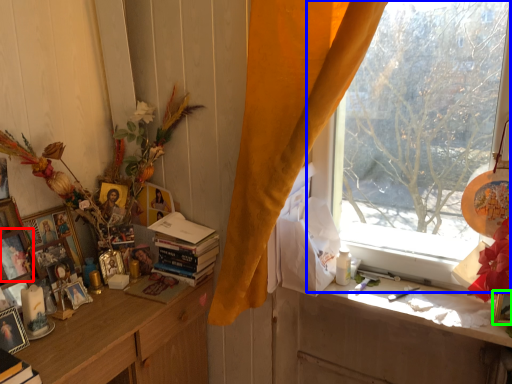
Question: Which is farther away from picture frame (highlighted by a red box)? window (highlighted by a blue box) or picture frame (highlighted by a green box)?

Choices:
 (A) window
 (B) picture frame

Answer: (B)